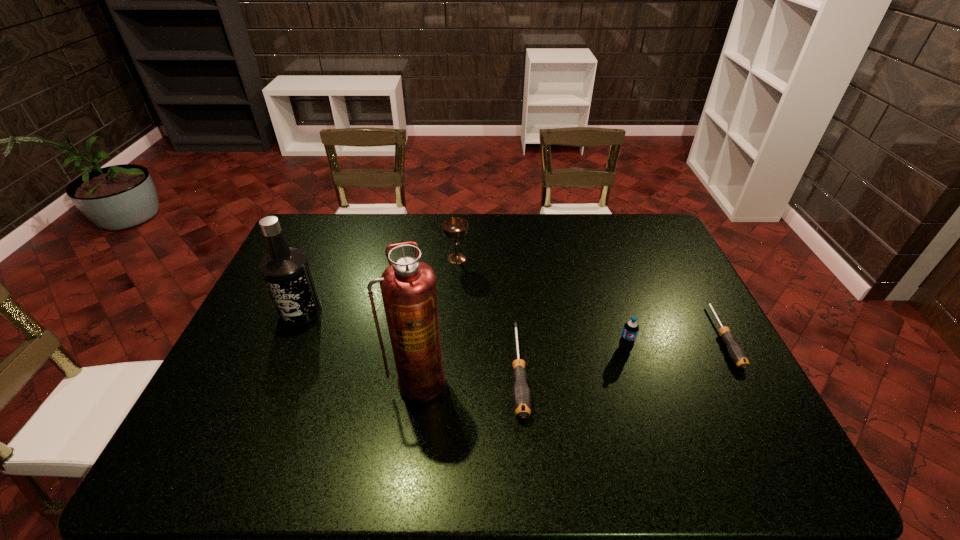
The image size is (960, 540). I want to click on free space at the far edge, so click(x=472, y=243).

At what (x,y) coordinates should I click in order to perform the action: click on vacant area at the right edge of the desktop. Please return your answer as a coordinate pair (x, y). The width and height of the screenshot is (960, 540). Looking at the image, I should click on (644, 292).

Find the location of a particular element. The image size is (960, 540). vacant space at the near left corner is located at coordinates (225, 425).

In the image, there is a desktop. Where is `free space at the far right corner`? The width and height of the screenshot is (960, 540). free space at the far right corner is located at coordinates (634, 240).

You are a GUI agent. You are given a task and a screenshot of the screen. Output one action in this format:
    pyautogui.click(x=<x>, y=<y>)
    Task: Click on the free space at the near right corner of the desktop
    The width and height of the screenshot is (960, 540).
    Given the screenshot: What is the action you would take?
    pyautogui.click(x=760, y=430)

Image resolution: width=960 pixels, height=540 pixels. Identify the location of free space between the shortest object and the third object from right to left. (620, 354).

At what (x,y) coordinates should I click in order to perform the action: click on free point between the soda bottle and the shortest object. Please return your answer as a coordinate pair (x, y). The width and height of the screenshot is (960, 540). Looking at the image, I should click on (673, 343).

Identify the location of free space between the second tallest object and the fire extinguisher. The height and width of the screenshot is (540, 960). (360, 347).

Find the location of `unoccupied position between the liquor and the right screwdriver`. unoccupied position between the liquor and the right screwdriver is located at coordinates (512, 323).

You are a GUI agent. You are given a task and a screenshot of the screen. Output one action in this format:
    pyautogui.click(x=<x>, y=<y>)
    Task: Click on the vacant space that's between the tallest object and the second tallest object
    The height and width of the screenshot is (540, 960).
    Given the screenshot: What is the action you would take?
    pyautogui.click(x=360, y=347)